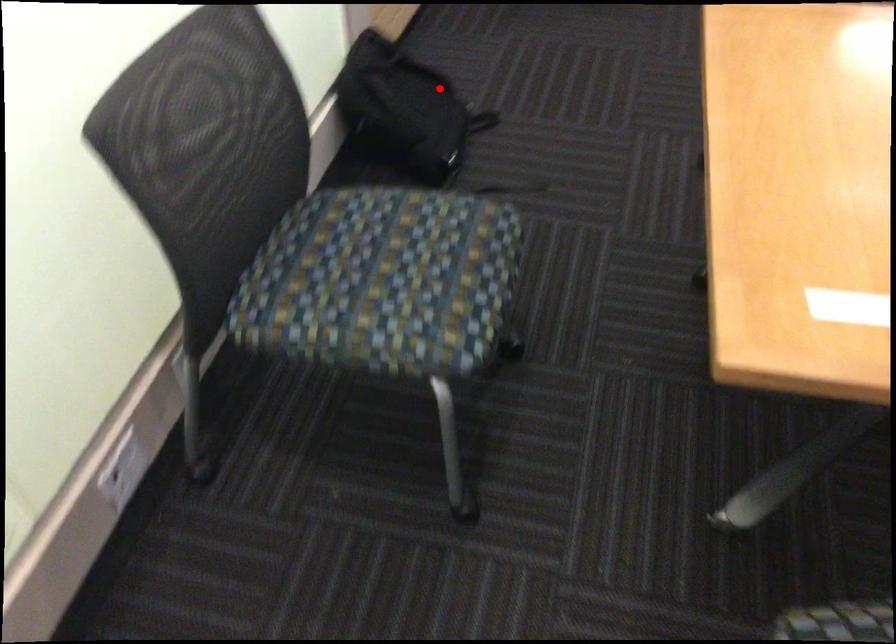
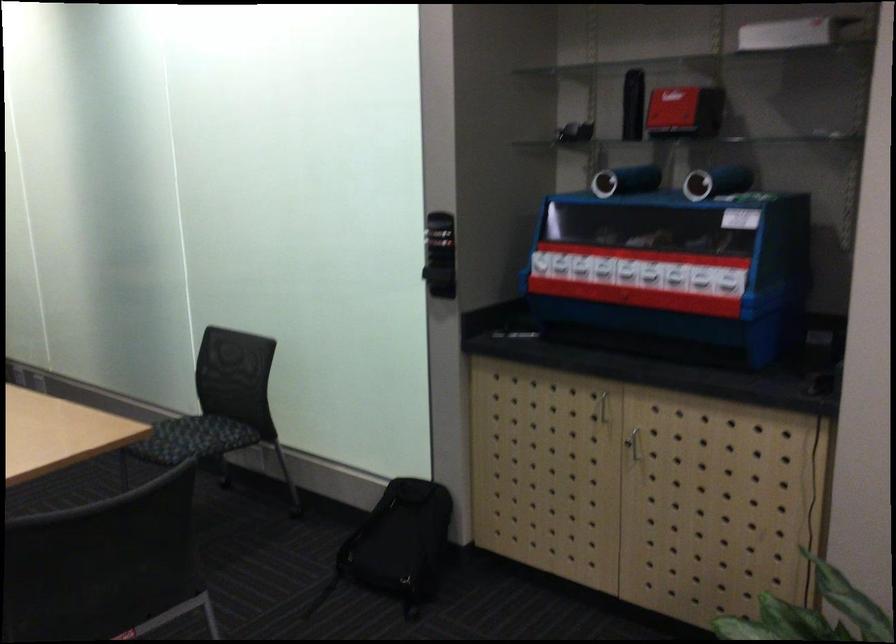
Question: I am providing you with two images of the same scene from different viewpoints. A red point is marked on the first image. Can you still see the location of the red point in image 2?

Choices:
 (A) Yes
 (B) No

Answer: (A)